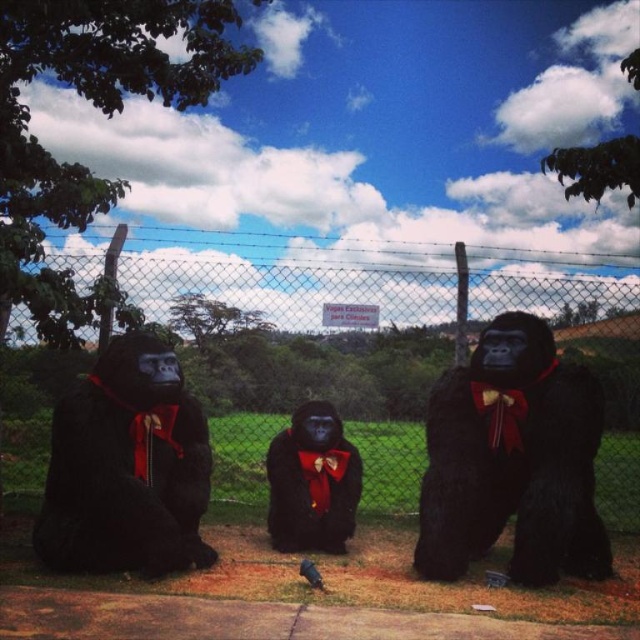
You are a visitor at a park and see the matte black gorilla at left and the velvet black gorilla at center. Which one is larger in size?

The matte black gorilla at left is bigger than the velvet black gorilla at center.